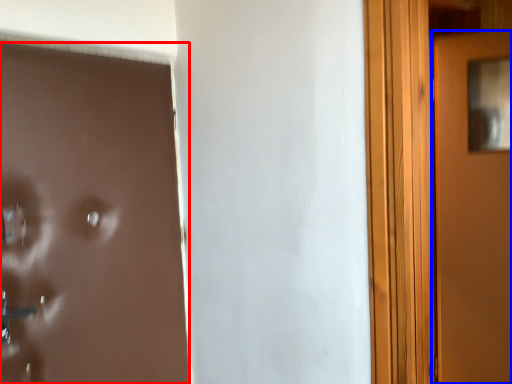
Question: Which object is closer to the camera taking this photo, door (highlighted by a red box) or door (highlighted by a blue box)?

Choices:
 (A) door
 (B) door

Answer: (A)